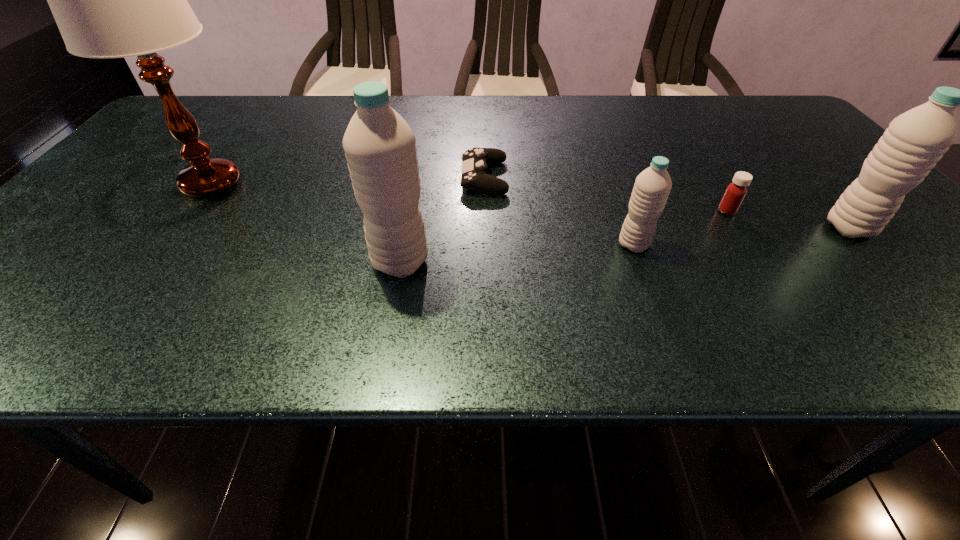
The height and width of the screenshot is (540, 960). Find the location of `the leftmost water bottle`. the leftmost water bottle is located at coordinates (379, 145).

The width and height of the screenshot is (960, 540). Identify the location of the fourth object from left to right. (652, 186).

Where is `the shortest water bottle`? The width and height of the screenshot is (960, 540). the shortest water bottle is located at coordinates (652, 186).

Locate an element on the screen. the rightmost object is located at coordinates (916, 140).

The image size is (960, 540). Find the location of `the second shortest water bottle`. the second shortest water bottle is located at coordinates (916, 140).

Where is `the tallest object`? The image size is (960, 540). the tallest object is located at coordinates (110, 0).

The image size is (960, 540). I want to click on table lamp, so click(x=110, y=0).

This screenshot has width=960, height=540. What are the coordinates of `the second object from right to left` in the screenshot? It's located at (736, 191).

The width and height of the screenshot is (960, 540). What are the coordinates of `medicine` in the screenshot? It's located at (736, 191).

The height and width of the screenshot is (540, 960). In order to click on the third object from left to right in this screenshot , I will do `click(475, 160)`.